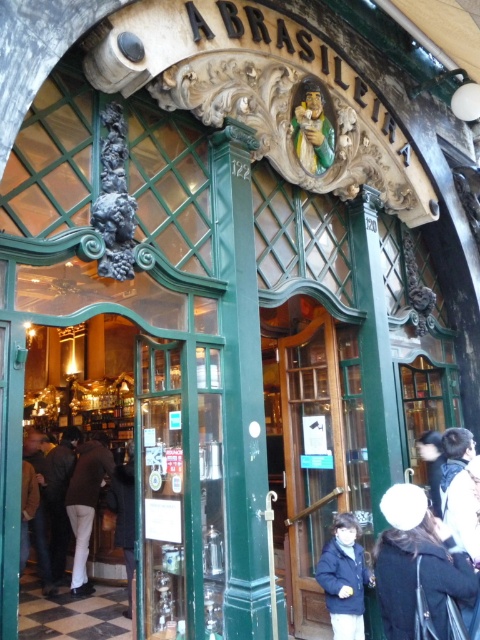
Question: Which of the following is the farthest from the observer?

Choices:
 (A) dark blue jacket at lower center
 (B) white matte pants at lower left

Answer: (B)

Question: Can you confirm if green polished wood pillar at center is positioned above dark brown leather jacket at lower left?

Choices:
 (A) no
 (B) yes

Answer: (B)

Question: Which of the following is the closest to the observer?

Choices:
 (A) (434, 472)
 (B) (61, 541)
 (C) (361, 556)
 (D) (444, 602)

Answer: (D)

Question: Does white fur coat at lower right have a larger size compared to dark blue jacket at center?

Choices:
 (A) yes
 (B) no

Answer: (A)

Question: Among these objects, which one is farthest from the camera?

Choices:
 (A) dark brown leather jacket at lower left
 (B) dark blue jacket at center
 (C) white fur coat at lower right

Answer: (A)

Question: Where is green polished wood pillar at center located in relation to white fur coat at lower right in the image?

Choices:
 (A) below
 (B) above

Answer: (B)